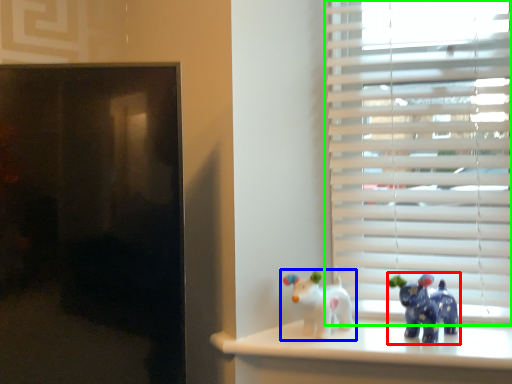
Question: Considering the real-world distances, which object is closest to toy (highlighted by a red box)? toy (highlighted by a blue box) or window blind (highlighted by a green box).

Choices:
 (A) toy
 (B) window blind

Answer: (A)